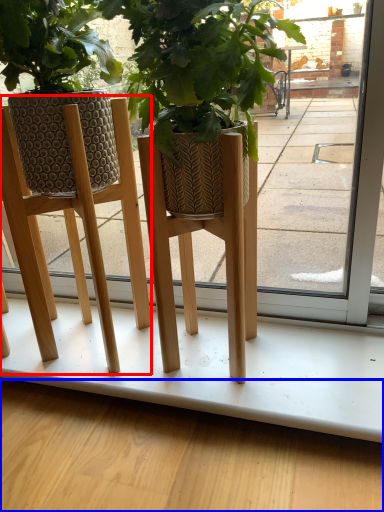
Question: Which of the following is the farthest to the observer, furniture (highlighted by a red box) or pavement (highlighted by a blue box)?

Choices:
 (A) furniture
 (B) pavement

Answer: (B)